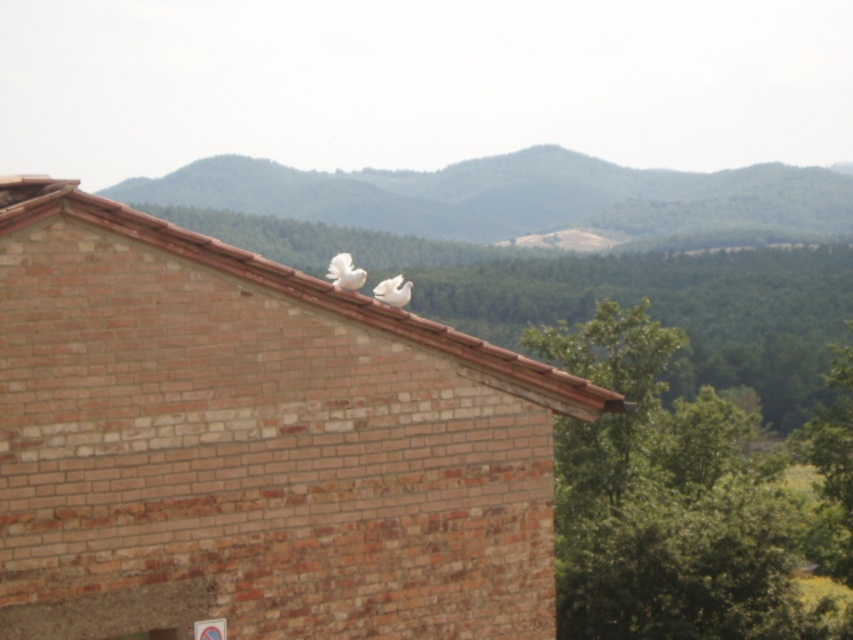
Question: Does brown tile roof at upper center have a lesser width compared to white feathered bird at center?

Choices:
 (A) no
 (B) yes

Answer: (A)

Question: Does brown tile roof at upper center appear over white feathered bird at center?

Choices:
 (A) no
 (B) yes

Answer: (A)

Question: Which point appears closest to the camera in this image?

Choices:
 (A) (408, 285)
 (B) (395, 324)

Answer: (B)

Question: Does brown tile roof at upper center have a lesser width compared to white feathered bird at center?

Choices:
 (A) yes
 (B) no

Answer: (B)